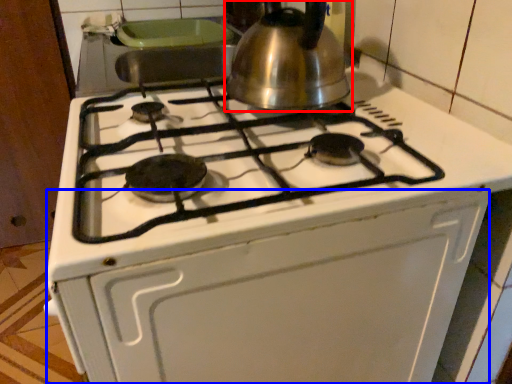
Question: Which object appears closest to the camera in this image, kettle (highlighted by a red box) or oven (highlighted by a blue box)?

Choices:
 (A) kettle
 (B) oven

Answer: (B)